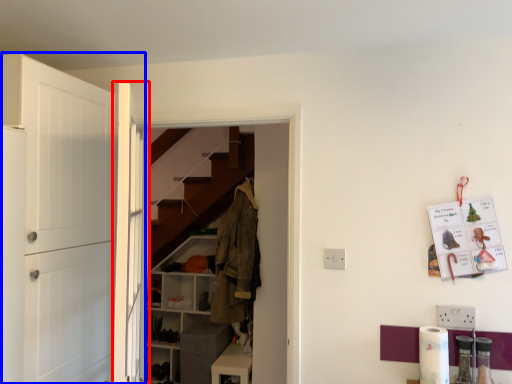
Question: Which point is further to the camera, door (highlighted by a red box) or door (highlighted by a blue box)?

Choices:
 (A) door
 (B) door

Answer: (B)